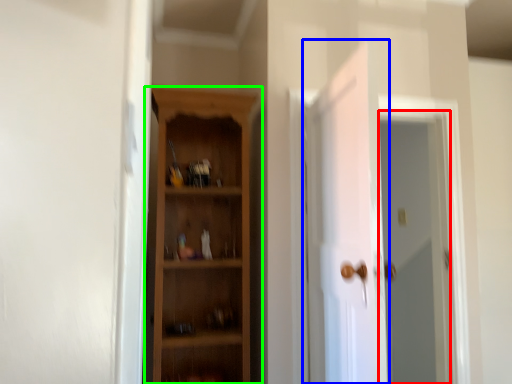
Question: Which object is the farthest from screen door (highlighted by a red box)? Choose among these: door (highlighted by a blue box) or cupboard (highlighted by a green box).

Choices:
 (A) door
 (B) cupboard

Answer: (B)